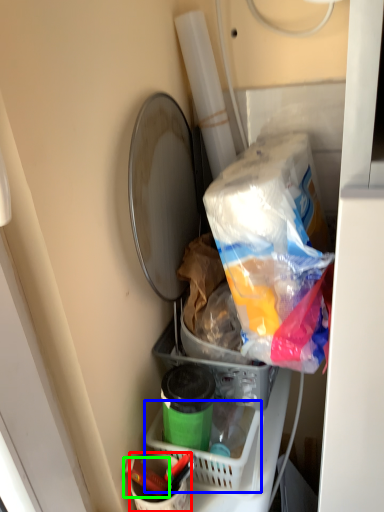
Question: Which object is the farthest from bucket (highlighted by a red box)? Choose among these: basket (highlighted by a blue box) or crayon (highlighted by a green box).

Choices:
 (A) basket
 (B) crayon

Answer: (A)